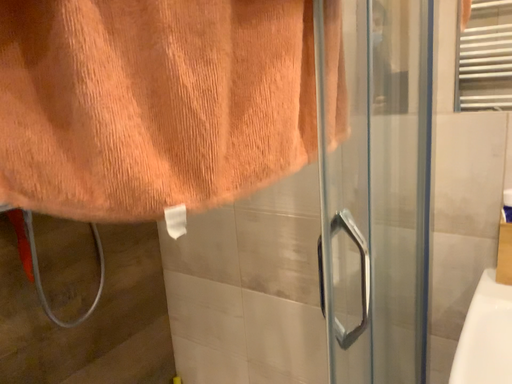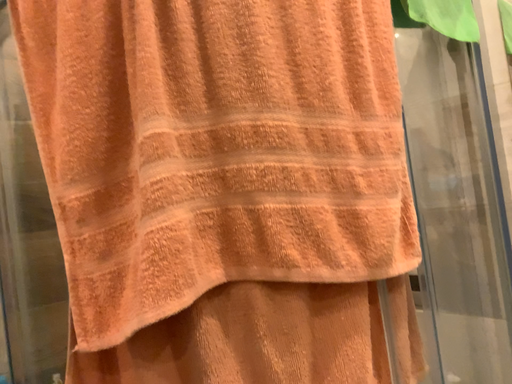
Question: Which way did the camera rotate in the video?

Choices:
 (A) rotated right
 (B) rotated left

Answer: (B)